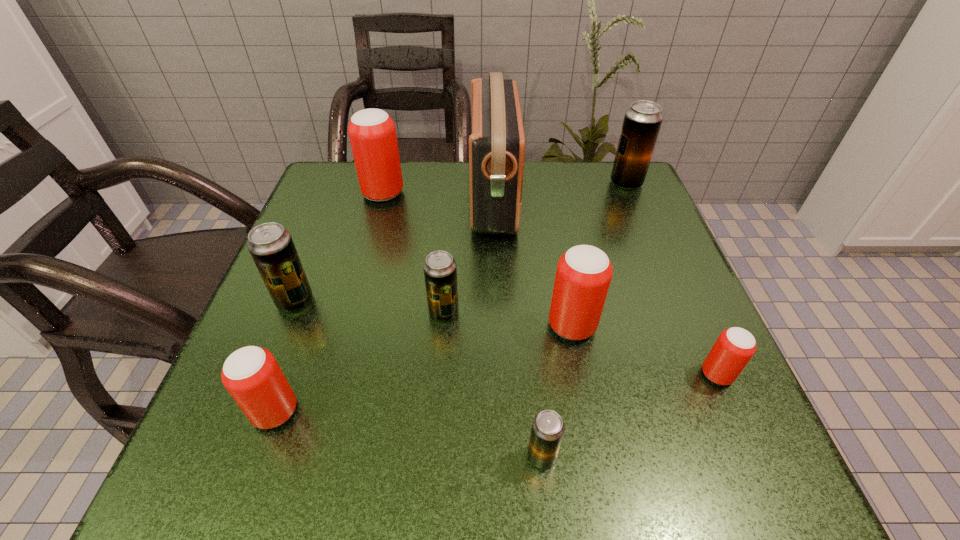
Identify the location of the third biggest red beer can. (251, 374).

Identify the location of the rightmost red beer can. Image resolution: width=960 pixels, height=540 pixels. (735, 346).

Locate an element on the screen. the third farthest red beer can is located at coordinates (735, 346).

Identify the location of the fifth beer can from left to right. (548, 427).

Locate an element on the screen. This screenshot has width=960, height=540. the smallest black beer can is located at coordinates (548, 427).

Find the location of `vacant space positioned on the front-facing side of the radio receiver`. vacant space positioned on the front-facing side of the radio receiver is located at coordinates (334, 198).

Where is `free location located 0.110m on the front-facing side of the radio receiver`? The image size is (960, 540). free location located 0.110m on the front-facing side of the radio receiver is located at coordinates (425, 198).

At what (x,y) coordinates should I click in order to perform the action: click on free space located on the front-facing side of the radio receiver. Please return your answer as a coordinate pair (x, y). Image resolution: width=960 pixels, height=540 pixels. Looking at the image, I should click on (450, 198).

Find the location of `free location located 0.330m on the front of the farthest red beer can`. free location located 0.330m on the front of the farthest red beer can is located at coordinates (351, 313).

This screenshot has height=540, width=960. Find the location of `blank space located 0.180m on the left of the rightmost black beer can`. blank space located 0.180m on the left of the rightmost black beer can is located at coordinates (539, 183).